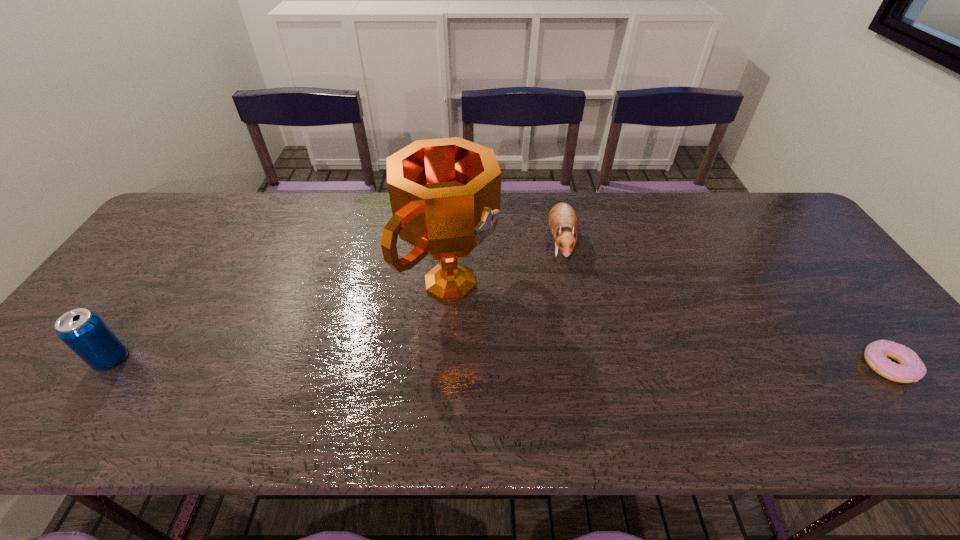
At what (x,y) coordinates should I click in order to perform the action: click on free location located on the side of the third object from right to left with the star emblem. Please return your answer as a coordinate pair (x, y). Looking at the image, I should click on (600, 370).

This screenshot has width=960, height=540. Find the location of `vacant space located on the side of the third object from right to left with the star emblem`. vacant space located on the side of the third object from right to left with the star emblem is located at coordinates (554, 345).

This screenshot has width=960, height=540. I want to click on free space located 0.390m on the side of the third object from right to left with the star emblem, so (634, 388).

The image size is (960, 540). I want to click on free space located 0.340m at the face of the hamster, so (x=560, y=368).

Where is `blank space located 0.190m at the face of the hamster`? blank space located 0.190m at the face of the hamster is located at coordinates (562, 319).

The image size is (960, 540). I want to click on free space located at the face of the hamster, so click(x=561, y=350).

Where is `object that is at the far edge`? object that is at the far edge is located at coordinates (563, 222).

Where is `pop soda that is positioned at the near edge`? The width and height of the screenshot is (960, 540). pop soda that is positioned at the near edge is located at coordinates (84, 332).

You are a GUI agent. You are given a task and a screenshot of the screen. Output one action in this format:
    pyautogui.click(x=<x>, y=<y>)
    Task: Click on the doughnut located at the near edge
    Image resolution: width=960 pixels, height=540 pixels.
    Given the screenshot: What is the action you would take?
    pyautogui.click(x=910, y=369)

Find the location of a particular element. Image resolution: width=960 pixels, height=540 pixels. object located in the left edge section of the desktop is located at coordinates (84, 332).